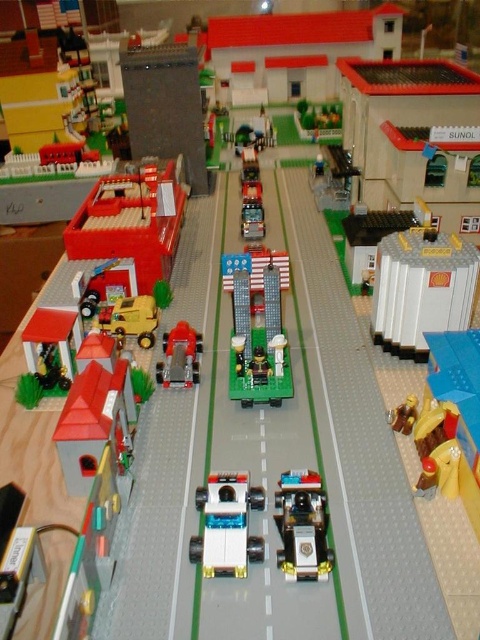
Question: Which of the following is the farthest from the observer?

Choices:
 (A) pos(168,380)
 (B) pos(229,264)
 (C) pos(300,573)
 (D) pos(237,493)

Answer: (B)

Question: Can you confirm if metallic silver train at center is positioned to the right of shiny black police car at center?

Choices:
 (A) yes
 (B) no

Answer: (B)

Question: Does metallic silver train at center appear over translucent white plastic car at center?

Choices:
 (A) no
 (B) yes

Answer: (B)

Question: Which object is closer to the camera taking this photo?

Choices:
 (A) metallic silver fire truck at center
 (B) metallic silver train at center
 (C) translucent white plastic car at center

Answer: (C)

Question: Does translucent white plastic car at center appear over metallic silver fire truck at center?

Choices:
 (A) yes
 (B) no

Answer: (B)

Question: Which of these objects is positioned closest to the shiny black police car at center?

Choices:
 (A) metallic silver fire truck at center
 (B) metallic silver train at center

Answer: (B)